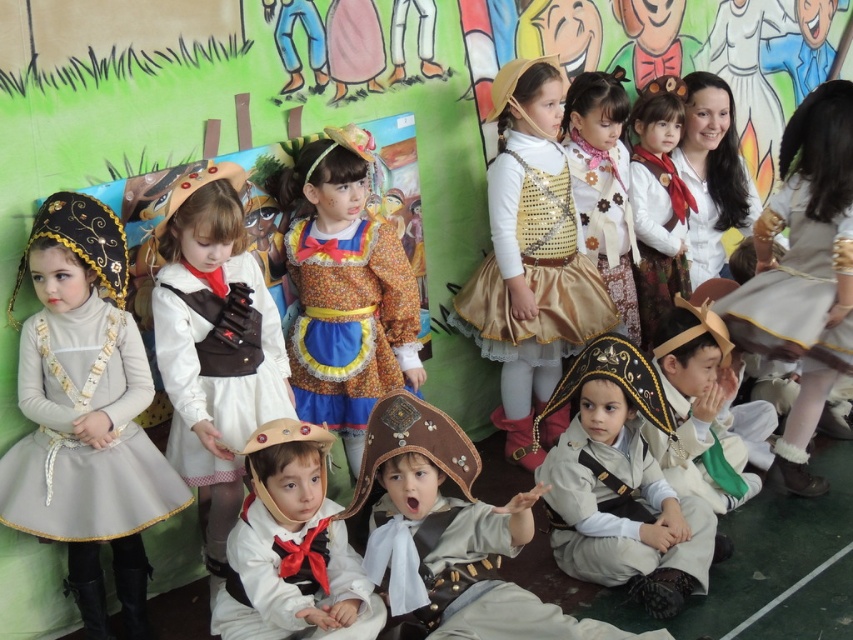
Question: Does matte brown hat at center come in front of floral fabric dress at center?

Choices:
 (A) yes
 (B) no

Answer: (A)

Question: Which object appears closest to the camera in this image?

Choices:
 (A) matte brown pirate hat at center
 (B) gold sequined dress at center
 (C) floral fabric dress at center
 (D) white matte shirt at center

Answer: (D)

Question: Where is floral fabric dress at center located in relation to gold sequined dress at upper right in the image?

Choices:
 (A) left
 (B) right

Answer: (A)

Question: Estimate the real-world distances between objects in this image. Which object is farther from the shiny gold vest at center?

Choices:
 (A) floral fabric dress at center
 (B) gold sequined dress at center

Answer: (A)

Question: Which object appears closest to the camera in this image?

Choices:
 (A) light gray satin dress at left
 (B) matte brown hat at center
 (C) white satin dress at center

Answer: (A)

Question: Can you confirm if gold sequined dress at center is positioned to the right of floral fabric dress at center?

Choices:
 (A) no
 (B) yes

Answer: (B)